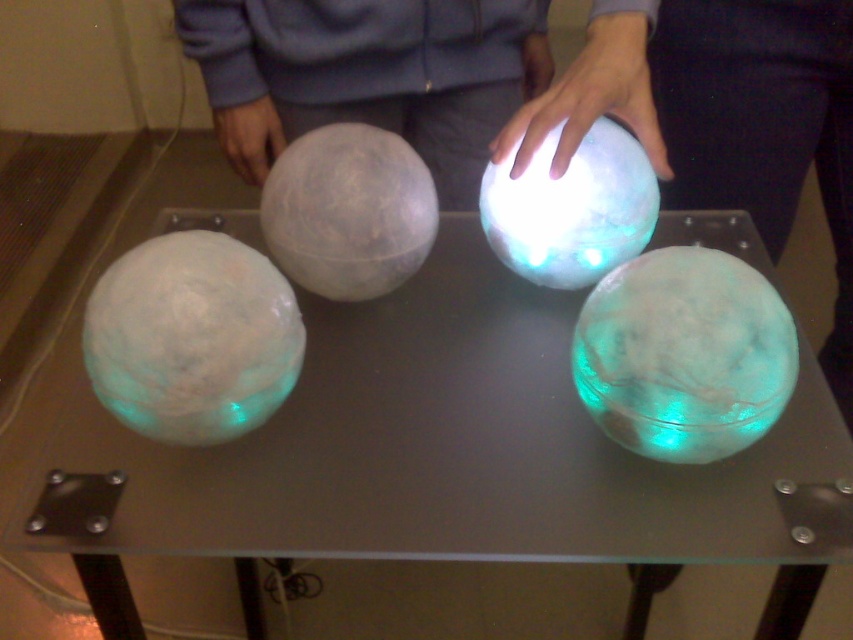
Is translucent glass spheres at center to the left of matte gray sphere at center from the viewer's perspective?

In fact, translucent glass spheres at center is to the right of matte gray sphere at center.

What do you see at coordinates (440, 460) in the screenshot? I see `translucent glass spheres at center` at bounding box center [440, 460].

Does point (407, 364) lie in front of point (267, 108)?

Yes, point (407, 364) is closer to viewer.

This screenshot has width=853, height=640. I want to click on translucent glass spheres at center, so click(440, 460).